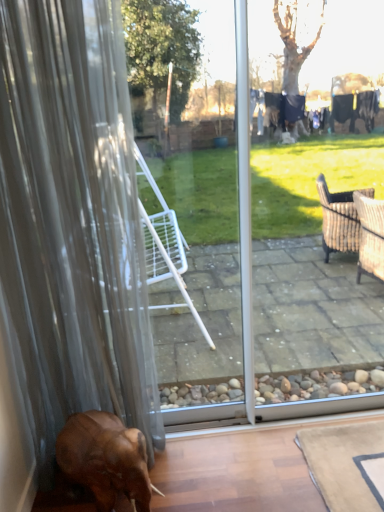
This screenshot has width=384, height=512. What do you see at coordinates (105, 459) in the screenshot?
I see `brown matte elephant at lower left` at bounding box center [105, 459].

What is the approximate width of brown matte elephant at lower left?

It is 66.42 centimeters.

This screenshot has width=384, height=512. Find the location of `brown matte elephant at lower left`. brown matte elephant at lower left is located at coordinates (105, 459).

This screenshot has width=384, height=512. What do you see at coordinates (70, 229) in the screenshot? I see `translucent fabric curtain at left` at bounding box center [70, 229].

Identify the location of translucent fabric curtain at left. (70, 229).

Where is `brown matte elephant at lower left`? The height and width of the screenshot is (512, 384). brown matte elephant at lower left is located at coordinates (105, 459).

In the scene shown: Considering the relative positions of translucent fabric curtain at left and brown matte elephant at lower left in the image provided, is translucent fabric curtain at left to the left of brown matte elephant at lower left from the viewer's perspective?

Yes, translucent fabric curtain at left is to the left of brown matte elephant at lower left.

Is translucent fabric curtain at left in front of brown matte elephant at lower left?

Yes.

Is point (65, 243) farther from viewer compared to point (102, 465)?

Yes, point (65, 243) is farther from viewer.

Consider the image. From the image's perspective, is translucent fabric curtain at left located above or below brown matte elephant at lower left?

From the image's perspective, translucent fabric curtain at left appears above brown matte elephant at lower left.

From a real-world perspective, which object rests below the other?

brown matte elephant at lower left, from a real-world perspective.

In the scene shown: Does translucent fabric curtain at left have a greater width compared to brown matte elephant at lower left?

No, translucent fabric curtain at left is not wider than brown matte elephant at lower left.

Who is shorter, translucent fabric curtain at left or brown matte elephant at lower left?

Standing shorter between the two is brown matte elephant at lower left.

Between translucent fabric curtain at left and brown matte elephant at lower left, which one has smaller size?

brown matte elephant at lower left.

Would you say brown matte elephant at lower left is part of translucent fabric curtain at left's contents?

Yes, brown matte elephant at lower left is a part of translucent fabric curtain at left.

Are translucent fabric curtain at left and brown matte elephant at lower left beside each other?

translucent fabric curtain at left and brown matte elephant at lower left are clearly separated.

Could you tell me if translucent fabric curtain at left is turned towards brown matte elephant at lower left?

Yes, translucent fabric curtain at left is oriented towards brown matte elephant at lower left.

Can you tell me how much translucent fabric curtain at left and brown matte elephant at lower left differ in facing direction?

The angular difference between translucent fabric curtain at left and brown matte elephant at lower left is 36.7 degrees.

Locate an element on the screen. This screenshot has width=384, height=512. dog below the translucent fabric curtain at left (from the image's perspective) is located at coordinates (105, 459).

Is brown matte elephant at lower left to the right of translucent fabric curtain at left from the viewer's perspective?

Correct, you'll find brown matte elephant at lower left to the right of translucent fabric curtain at left.

Is the position of brown matte elephant at lower left more distant than that of translucent fabric curtain at left?

Yes, the depth of brown matte elephant at lower left is greater than that of translucent fabric curtain at left.

Does point (81, 457) come in front of point (104, 167)?

No, (81, 457) is further to viewer.

From the image's perspective, is brown matte elephant at lower left below translucent fabric curtain at left?

Indeed, from the image's perspective, brown matte elephant at lower left is shown beneath translucent fabric curtain at left.

In the scene shown: From a real-world perspective, relative to translucent fabric curtain at left, is brown matte elephant at lower left vertically above or below?

brown matte elephant at lower left is situated lower than translucent fabric curtain at left in the real world.

Looking at this image, is brown matte elephant at lower left wider than translucent fabric curtain at left?

Yes.

Does brown matte elephant at lower left have a greater height compared to translucent fabric curtain at left?

In fact, brown matte elephant at lower left may be shorter than translucent fabric curtain at left.

In terms of size, does brown matte elephant at lower left appear bigger or smaller than translucent fabric curtain at left?

In the image, brown matte elephant at lower left appears to be smaller than translucent fabric curtain at left.

Is brown matte elephant at lower left positioned beyond the bounds of translucent fabric curtain at left?

No, most part of brown matte elephant at lower left lies within translucent fabric curtain at left.

Is brown matte elephant at lower left with translucent fabric curtain at left?

brown matte elephant at lower left and translucent fabric curtain at left are not in contact.

Is brown matte elephant at lower left oriented away from translucent fabric curtain at left?

Yes, brown matte elephant at lower left is positioned with its back facing translucent fabric curtain at left.

This screenshot has height=512, width=384. Identify the location of curtain lying above the brown matte elephant at lower left (from the image's perspective). (70, 229).

Identify the location of dog behind the translucent fabric curtain at left. This screenshot has height=512, width=384. (105, 459).

Find the location of a particular element. This screenshot has height=512, width=384. curtain above the brown matte elephant at lower left (from a real-world perspective) is located at coordinates (70, 229).